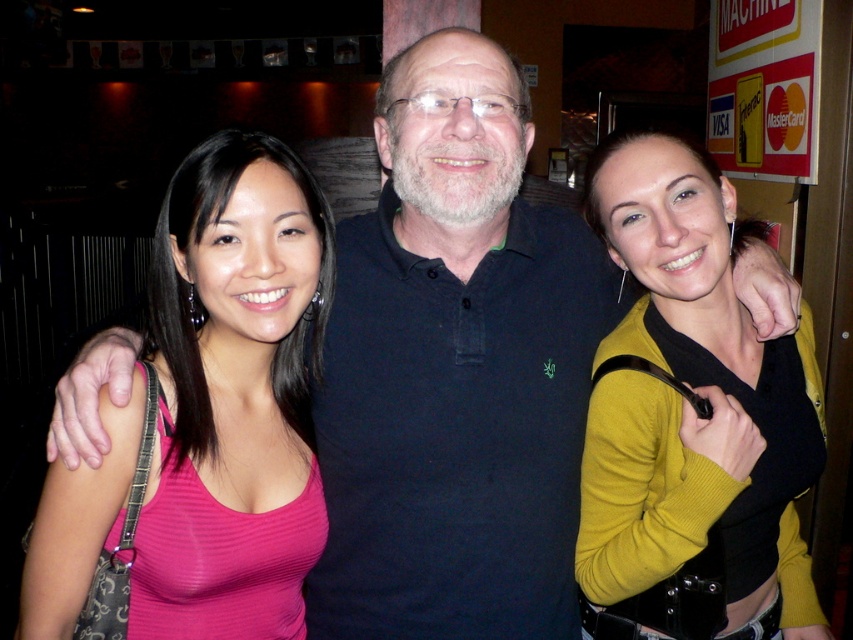
Question: Does pink ribbed tank top at left have a larger size compared to mustard yellow sweater at center?

Choices:
 (A) no
 (B) yes

Answer: (A)

Question: Which point is farther from the camera taking this photo?

Choices:
 (A) (709, 180)
 (B) (251, 196)

Answer: (A)

Question: Among these points, which one is nearest to the camera?

Choices:
 (A) (729, 506)
 (B) (236, 554)

Answer: (B)

Question: Does pink ribbed tank top at left appear on the left side of mustard yellow sweater at center?

Choices:
 (A) yes
 (B) no

Answer: (A)

Question: Can you confirm if pink ribbed tank top at left is bigger than mustard yellow sweater at center?

Choices:
 (A) no
 (B) yes

Answer: (A)